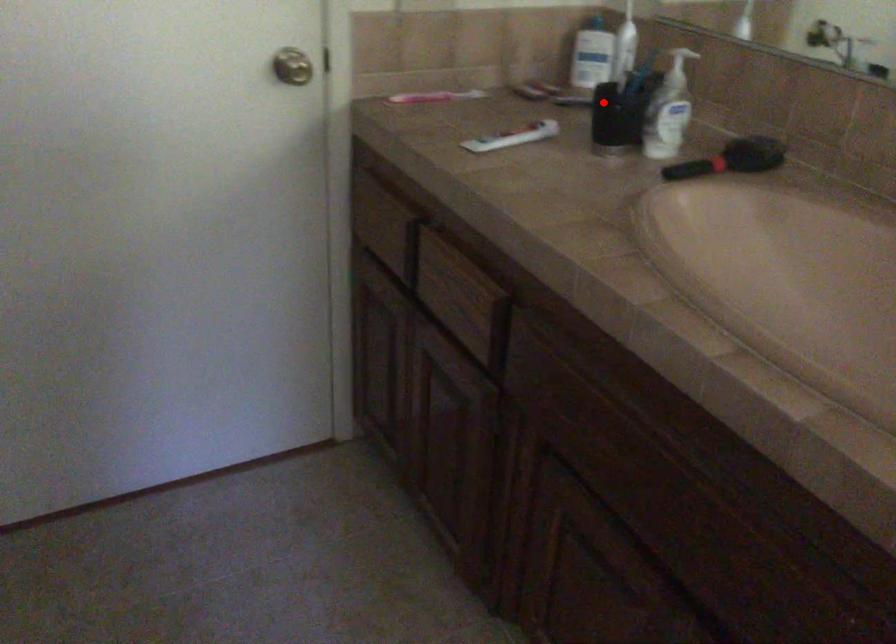
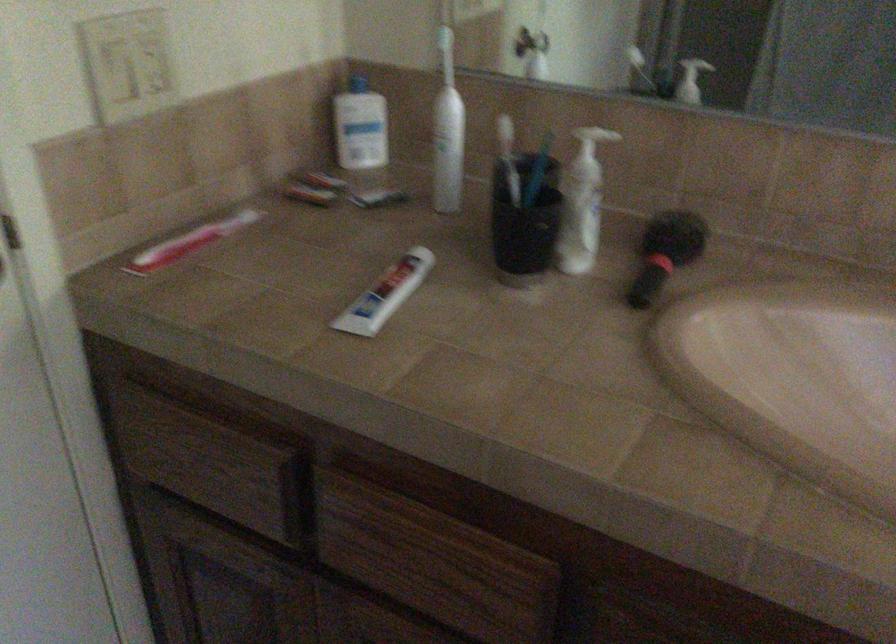
Question: A red point is marked in image1. In image2, is the corresponding 3D point closer to the camera or farther? Reply with the corresponding letter.

Choices:
 (A) The corresponding 3D point is closer.
 (B) The corresponding 3D point is farther.

Answer: (A)